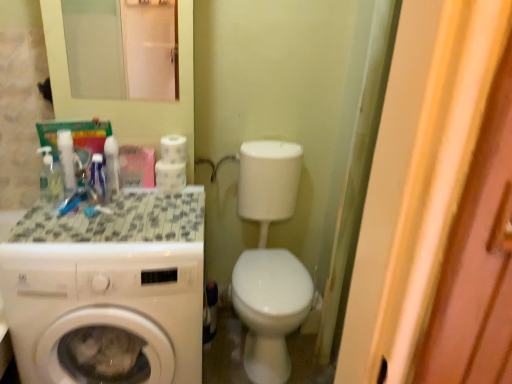
The width and height of the screenshot is (512, 384). I want to click on vacant space underneath tile mosaic countertop at left (from a real-world perspective), so pyautogui.click(x=126, y=217).